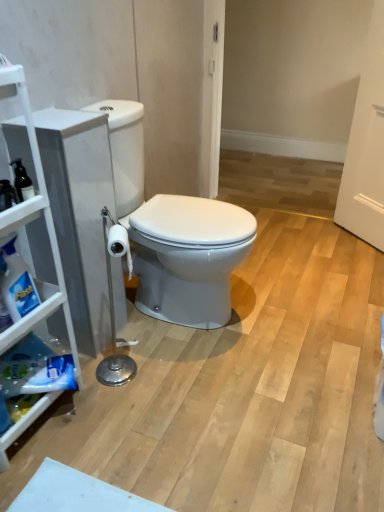
Where is `free space in front of white glossy toilet at center`? This screenshot has width=384, height=512. free space in front of white glossy toilet at center is located at coordinates (184, 391).